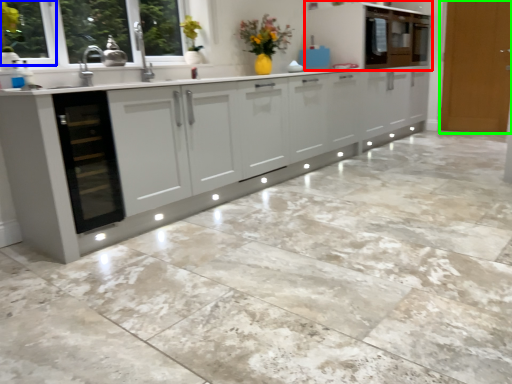
Question: Estimate the real-world distances between objects in this image. Which object is farther from cabinetry (highlighted by a red box), window frame (highlighted by a blue box) or door (highlighted by a green box)?

Choices:
 (A) window frame
 (B) door

Answer: (A)